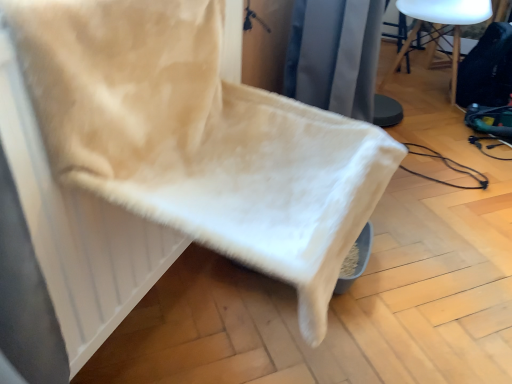
Question: Is black fabric chair at upper right thinner than white fluffy blanket at lower left?

Choices:
 (A) yes
 (B) no

Answer: (A)

Question: Would you consider black fabric chair at upper right to be distant from white fluffy blanket at lower left?

Choices:
 (A) yes
 (B) no

Answer: (A)

Question: Can you confirm if black fabric chair at upper right is smaller than white fluffy blanket at lower left?

Choices:
 (A) yes
 (B) no

Answer: (B)

Question: Does black fabric chair at upper right turn towards white fluffy blanket at lower left?

Choices:
 (A) no
 (B) yes

Answer: (B)

Question: Could white fluffy blanket at lower left be considered to be inside black fabric chair at upper right?

Choices:
 (A) yes
 (B) no

Answer: (B)

Question: Are black fabric chair at upper right and white fluffy blanket at lower left making contact?

Choices:
 (A) yes
 (B) no

Answer: (B)

Question: Is white fluffy blanket at lower left shorter than black fabric chair at upper right?

Choices:
 (A) no
 (B) yes

Answer: (B)

Question: From a real-world perspective, is white fluffy blanket at lower left located beneath black fabric chair at upper right?

Choices:
 (A) yes
 (B) no

Answer: (B)

Question: From the image's perspective, is white fluffy blanket at lower left beneath black fabric chair at upper right?

Choices:
 (A) yes
 (B) no

Answer: (A)

Question: From the image's perspective, is white fluffy blanket at lower left over black fabric chair at upper right?

Choices:
 (A) no
 (B) yes

Answer: (A)

Question: Is white fluffy blanket at lower left taller than black fabric chair at upper right?

Choices:
 (A) yes
 (B) no

Answer: (B)

Question: Does white fluffy blanket at lower left come behind black fabric chair at upper right?

Choices:
 (A) yes
 (B) no

Answer: (B)

Question: Is white fluffy blanket at lower left to the left or to the right of black fabric chair at upper right in the image?

Choices:
 (A) left
 (B) right

Answer: (A)